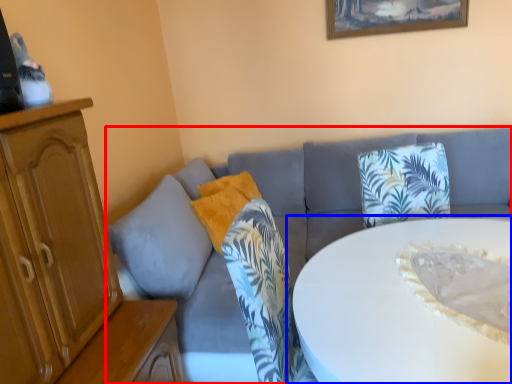
Question: Which object appears closest to the camera in this image, studio couch (highlighted by a red box) or table (highlighted by a blue box)?

Choices:
 (A) studio couch
 (B) table

Answer: (B)